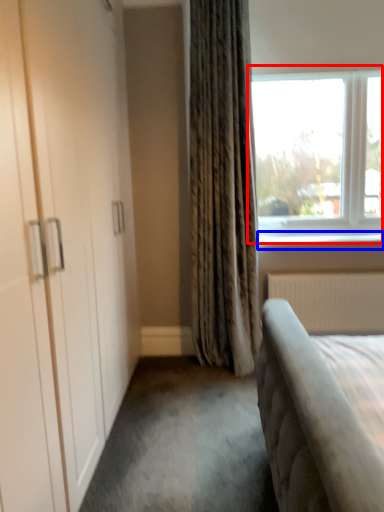
Question: Which object appears farthest to the camera in this image, window (highlighted by a red box) or window sill (highlighted by a blue box)?

Choices:
 (A) window
 (B) window sill

Answer: (B)